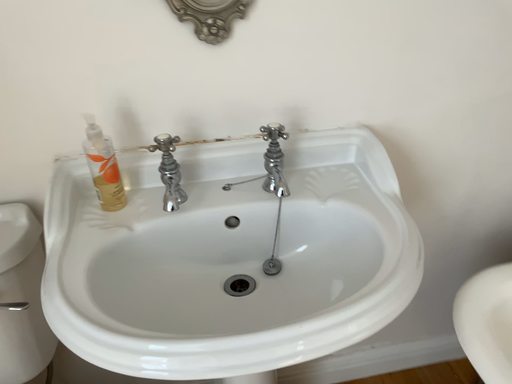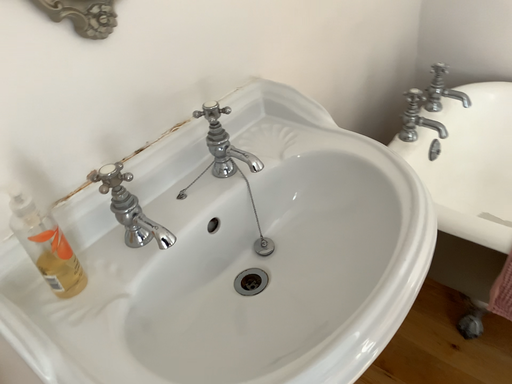
Question: How did the camera likely rotate when shooting the video?

Choices:
 (A) rotated right
 (B) rotated left

Answer: (A)